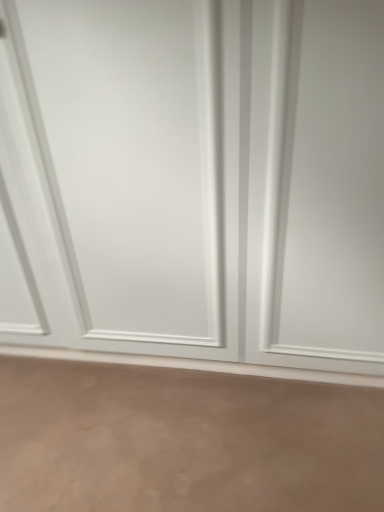
Locate an element on the screen. This screenshot has width=384, height=512. beige matte floor at lower center is located at coordinates (184, 441).

Describe the element at coordinates (184, 441) in the screenshot. This screenshot has height=512, width=384. I see `beige matte floor at lower center` at that location.

The image size is (384, 512). In order to click on beige matte floor at lower center in this screenshot , I will do `click(184, 441)`.